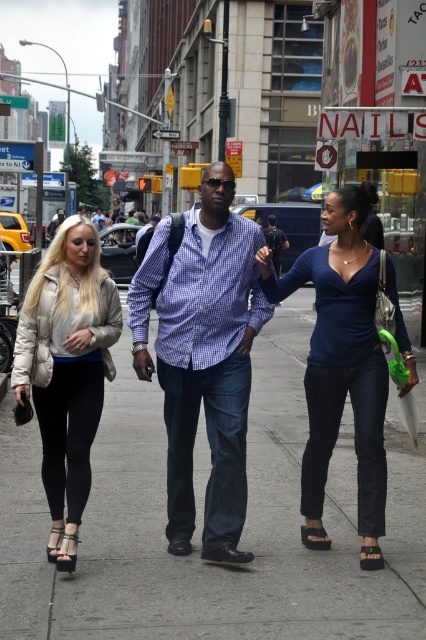
Question: Does purple checkered shirt at center lie in front of matte blue top at center?

Choices:
 (A) yes
 (B) no

Answer: (B)

Question: Considering the relative positions of gray concrete sidewalk at center and beige puffer jacket at left in the image provided, where is gray concrete sidewalk at center located with respect to beige puffer jacket at left?

Choices:
 (A) right
 (B) left

Answer: (A)

Question: Which point is closer to the camera taking this photo?

Choices:
 (A) (302, 563)
 (B) (54, 349)

Answer: (B)

Question: Which point appears closest to the camera in this image?

Choices:
 (A) (232, 577)
 (B) (360, 524)
 (C) (109, 307)
 (D) (189, 506)

Answer: (A)

Question: Where is gray concrete sidewalk at center located in relation to purple checkered shirt at center in the image?

Choices:
 (A) above
 (B) below

Answer: (B)

Question: Which object is positioned closest to the beige puffer jacket at left?

Choices:
 (A) gray concrete sidewalk at center
 (B) purple checkered shirt at center

Answer: (B)